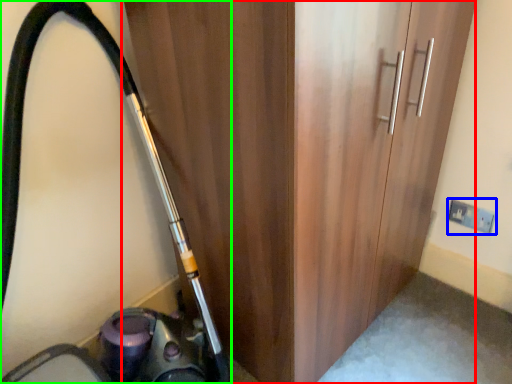
Question: Estimate the real-world distances between objects in this image. Which object is farther from door (highlighted by a red box), electric outlet (highlighted by a blue box) or equipment (highlighted by a green box)?

Choices:
 (A) electric outlet
 (B) equipment

Answer: (A)